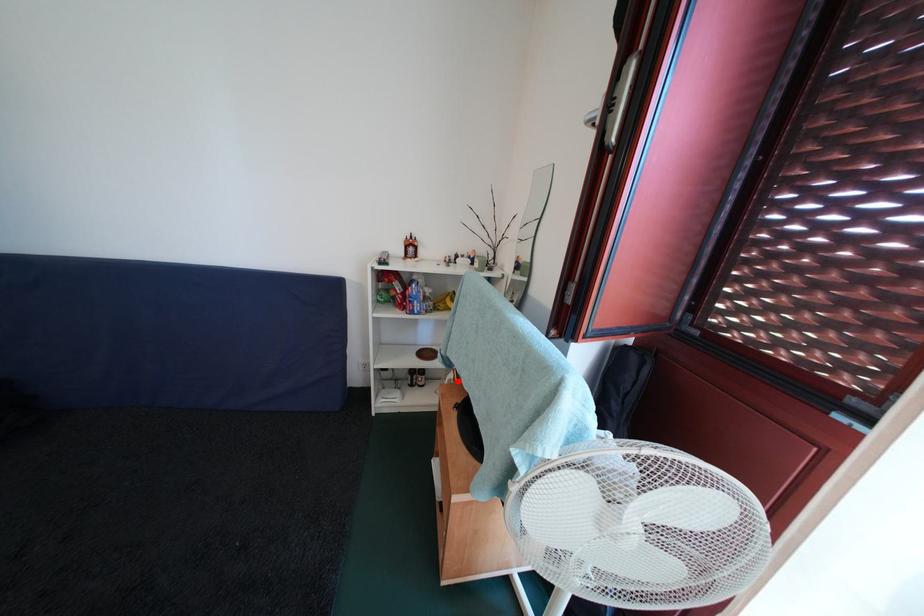
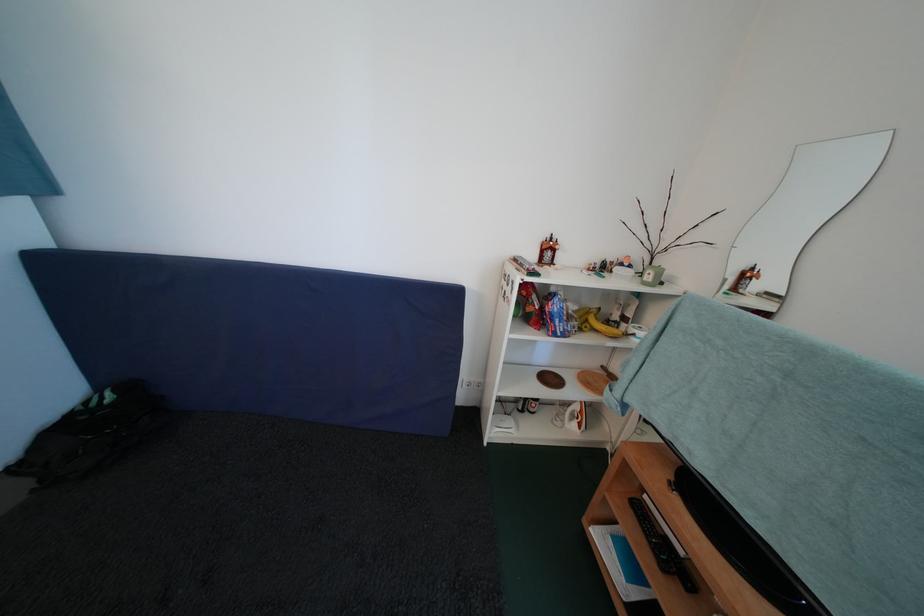
Question: A red point is marked in image1. In image2, is the corresponding 3D point closer to the camera or farther? Reply with the corresponding letter.

Choices:
 (A) The corresponding 3D point is closer.
 (B) The corresponding 3D point is farther.

Answer: (A)